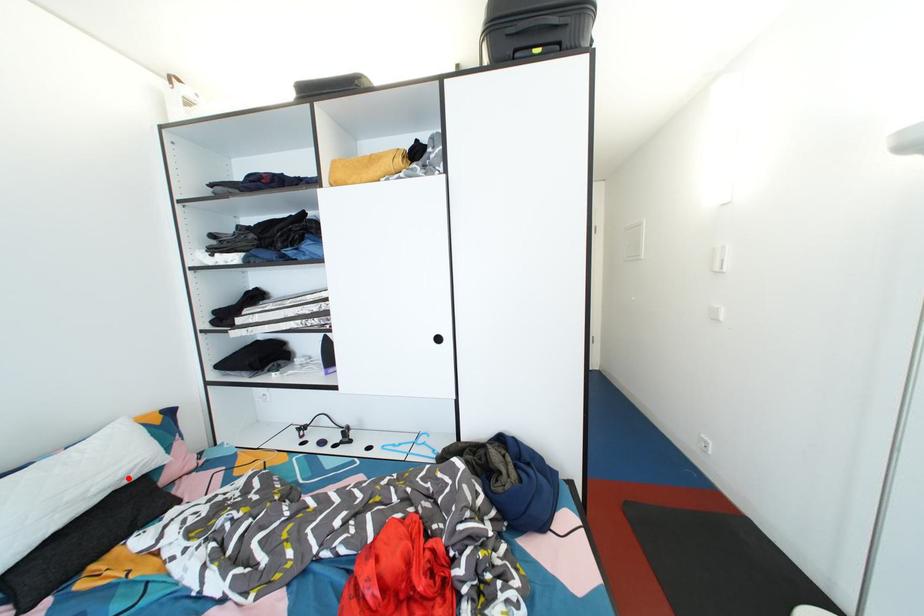
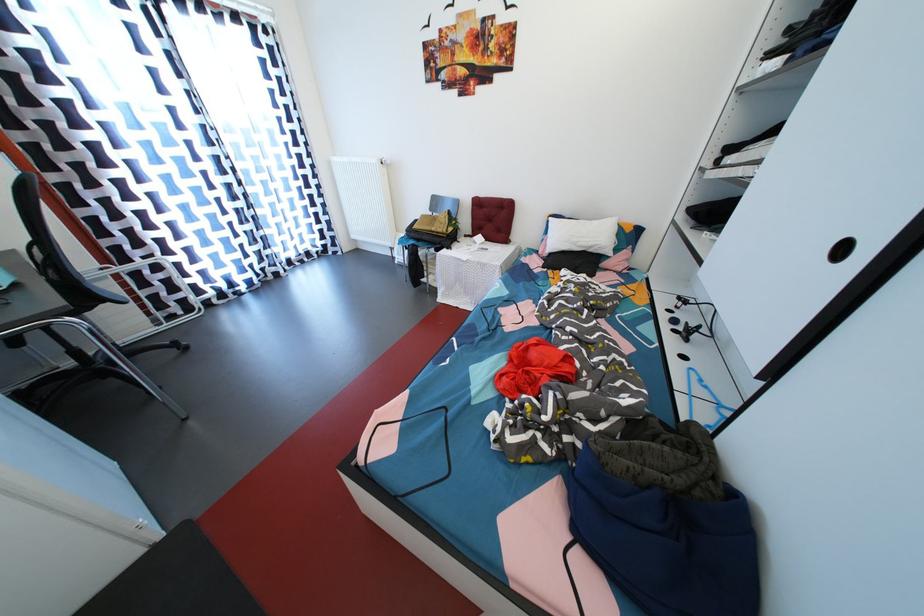
In the second image, find the point that corresponds to the highlighted location in the first image.

(597, 249)